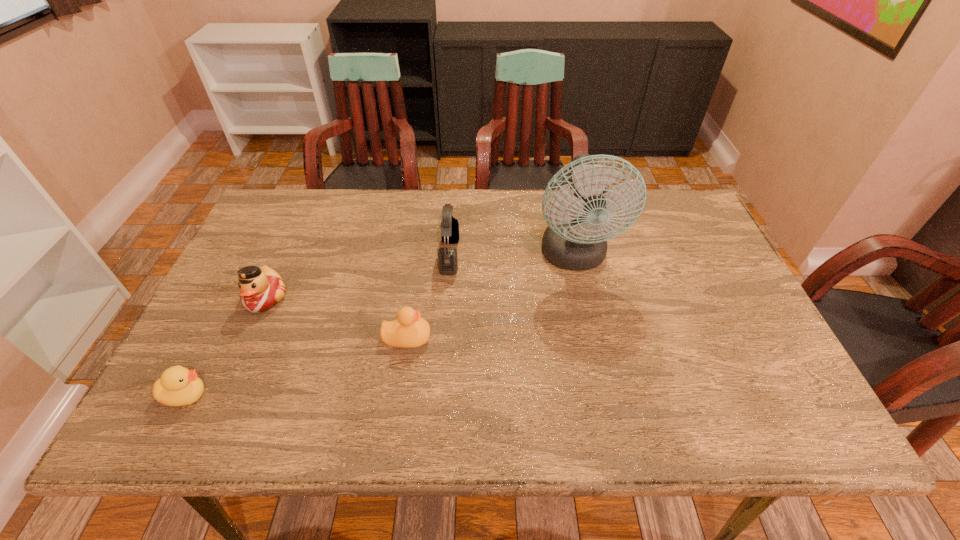
The height and width of the screenshot is (540, 960). Find the location of `the rightmost object`. the rightmost object is located at coordinates (575, 239).

This screenshot has height=540, width=960. Find the location of `fan`. fan is located at coordinates (575, 239).

I want to click on the fourth shortest object, so click(x=447, y=256).

Locate an element on the screen. The height and width of the screenshot is (540, 960). the fourth object from left to right is located at coordinates (447, 256).

At what (x,y) coordinates should I click in order to perform the action: click on the farthest duck. Please return your answer as a coordinate pair (x, y). This screenshot has height=540, width=960. Looking at the image, I should click on (262, 288).

Where is `the third object from left to right`? the third object from left to right is located at coordinates (409, 330).

The width and height of the screenshot is (960, 540). I want to click on the second nearest object, so [409, 330].

Image resolution: width=960 pixels, height=540 pixels. I want to click on the nearest duck, so click(178, 386).

Identify the location of vacant space situated in front of the fan where the airflow is directed. This screenshot has width=960, height=540. (608, 410).

Find the location of a particular element. vacant area located 0.290m on the headband of the fourth shortest object is located at coordinates (561, 255).